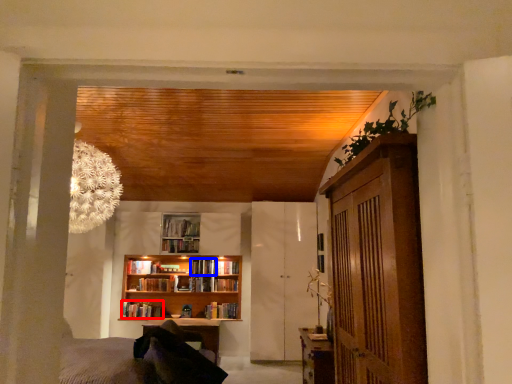
Question: Which object appears closest to the camera in this image, book (highlighted by a red box) or book (highlighted by a blue box)?

Choices:
 (A) book
 (B) book

Answer: (A)